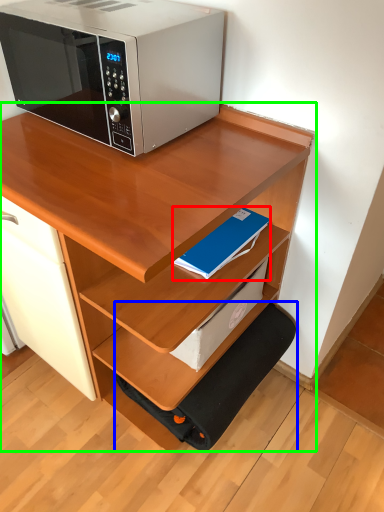
Question: Based on their relative distances, which object is farther from paperback book (highlighted by a red box)? Choose from step stool (highlighted by a blue box) and desk (highlighted by a green box).

Choices:
 (A) step stool
 (B) desk

Answer: (A)